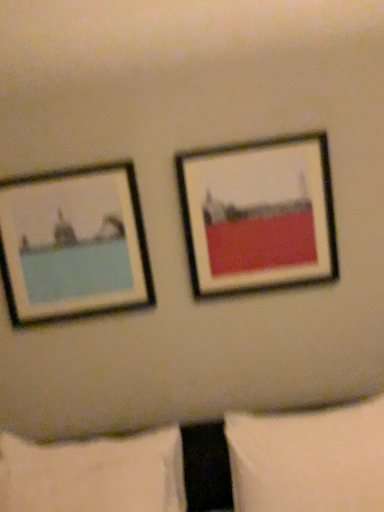
Question: Is matte black picture frame at upper right, placed as the 2th picture frame when sorted from left to right, far away from white soft pillow at lower right, the first pillow in the right-to-left sequence?

Choices:
 (A) yes
 (B) no

Answer: (B)

Question: From a real-world perspective, is matte black picture frame at upper right, placed as the 2th picture frame when sorted from left to right, below white soft pillow at lower right, positioned as the 2th pillow in left-to-right order?

Choices:
 (A) yes
 (B) no

Answer: (B)

Question: Is matte black picture frame at upper right, placed as the 2th picture frame when sorted from left to right, to the right of white soft pillow at lower right, positioned as the 2th pillow in left-to-right order, from the viewer's perspective?

Choices:
 (A) yes
 (B) no

Answer: (B)

Question: Does matte black picture frame at upper right, placed as the 2th picture frame when sorted from left to right, have a lesser height compared to white soft pillow at lower right, the first pillow in the right-to-left sequence?

Choices:
 (A) no
 (B) yes

Answer: (A)

Question: Can we say matte black picture frame at upper right, placed as the 2th picture frame when sorted from left to right, lies outside white soft pillow at lower right, the first pillow in the right-to-left sequence?

Choices:
 (A) no
 (B) yes

Answer: (B)

Question: Is matte black picture frame at left, which is the 1th picture frame from left to right, to the left or to the right of matte black picture frame at upper right, placed as the 2th picture frame when sorted from left to right, in the image?

Choices:
 (A) left
 (B) right

Answer: (A)

Question: Is point (1, 195) positioned closer to the camera than point (284, 219)?

Choices:
 (A) farther
 (B) closer

Answer: (A)

Question: Is matte black picture frame at left, which appears as the second picture frame when viewed from the right, taller or shorter than matte black picture frame at upper right, the first picture frame when ordered from right to left?

Choices:
 (A) short
 (B) tall

Answer: (A)

Question: In terms of width, does matte black picture frame at left, which is the 1th picture frame from left to right, look wider or thinner when compared to matte black picture frame at upper right, placed as the 2th picture frame when sorted from left to right?

Choices:
 (A) wide
 (B) thin

Answer: (A)

Question: Considering their positions, is matte black picture frame at upper right, the first picture frame when ordered from right to left, located in front of or behind matte black picture frame at left, which appears as the second picture frame when viewed from the right?

Choices:
 (A) front
 (B) behind

Answer: (A)

Question: Considering the positions of matte black picture frame at upper right, placed as the 2th picture frame when sorted from left to right, and matte black picture frame at left, which appears as the second picture frame when viewed from the right, in the image, is matte black picture frame at upper right, placed as the 2th picture frame when sorted from left to right, wider or thinner than matte black picture frame at left, which appears as the second picture frame when viewed from the right,?

Choices:
 (A) wide
 (B) thin

Answer: (B)

Question: Based on their sizes in the image, would you say matte black picture frame at upper right, placed as the 2th picture frame when sorted from left to right, is bigger or smaller than matte black picture frame at left, which is the 1th picture frame from left to right?

Choices:
 (A) big
 (B) small

Answer: (A)

Question: From the image's perspective, is matte black picture frame at upper right, placed as the 2th picture frame when sorted from left to right, located above or below matte black picture frame at left, which appears as the second picture frame when viewed from the right?

Choices:
 (A) above
 (B) below

Answer: (A)

Question: Considering the positions of point (38, 488) and point (266, 481), is point (38, 488) closer or farther from the camera than point (266, 481)?

Choices:
 (A) farther
 (B) closer

Answer: (A)

Question: In terms of width, does white soft pillow at lower left, positioned as the 1th pillow in left-to-right order, look wider or thinner when compared to white soft pillow at lower right, positioned as the 2th pillow in left-to-right order?

Choices:
 (A) thin
 (B) wide

Answer: (B)